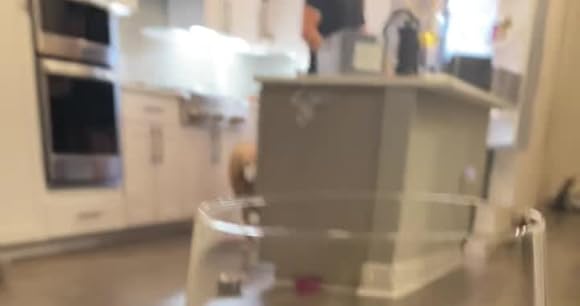
This screenshot has width=580, height=306. I want to click on glass, so click(x=210, y=239).